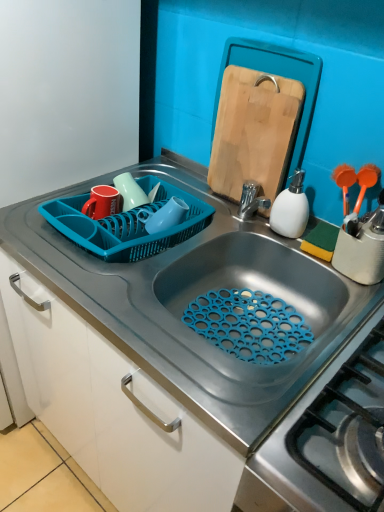
At what (x,y) coordinates should I click in order to perform the action: click on free space in front of matte ceramic mugs at upper center, which appears as the first tableware when viewed from the right. Please return your answer as a coordinate pair (x, y). The image size is (384, 512). Looking at the image, I should click on (117, 257).